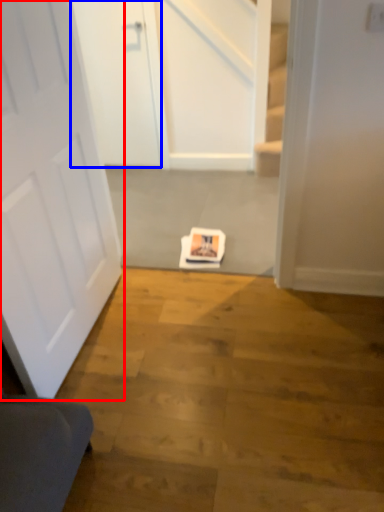
Question: Which object is further to the camera taking this photo, door (highlighted by a red box) or door (highlighted by a blue box)?

Choices:
 (A) door
 (B) door

Answer: (B)